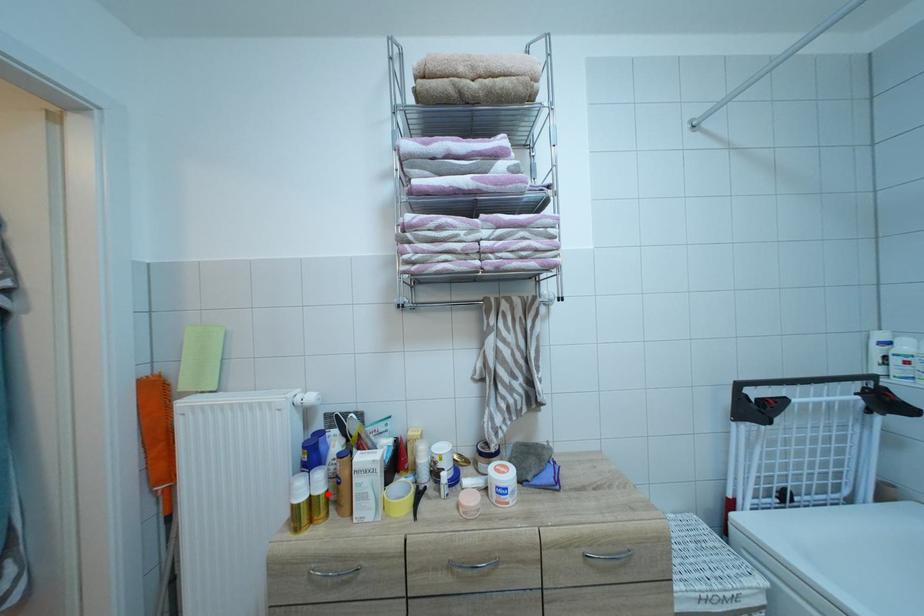
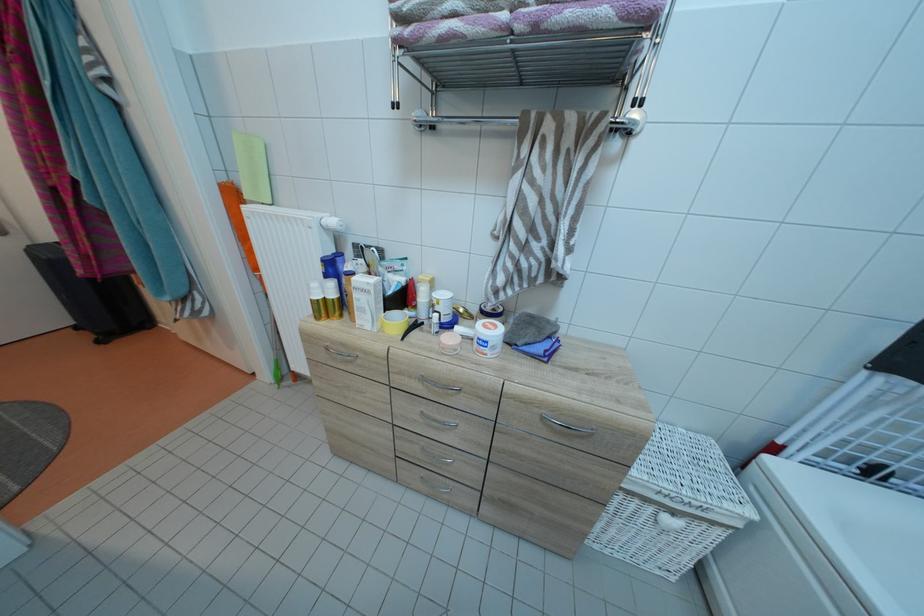
Find the pixel in the second image that matches the highlighted location in the first image.

(341, 301)